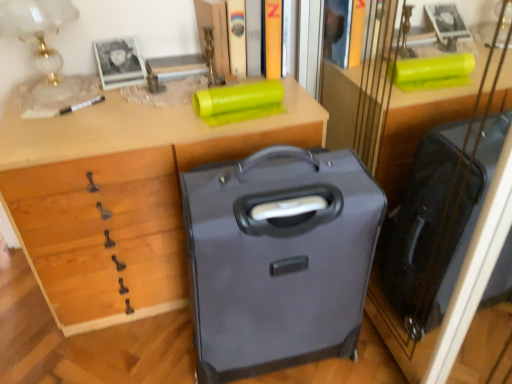
This screenshot has height=384, width=512. I want to click on vacant space in front of matte glass table lamp at upper left, so click(x=46, y=125).